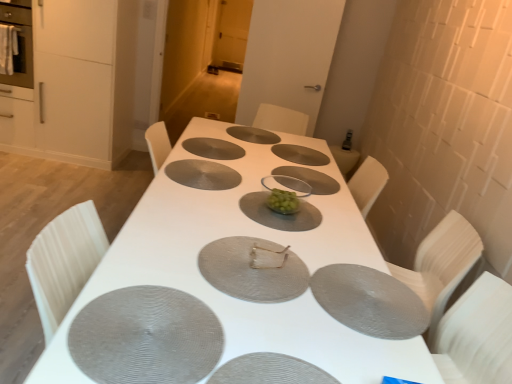
Find the location of `vacant point above matte gray pizza pan at center, acting as the 2th pizza pan starting from the back (from a real-world perspective)`. vacant point above matte gray pizza pan at center, acting as the 2th pizza pan starting from the back (from a real-world perspective) is located at coordinates (294, 148).